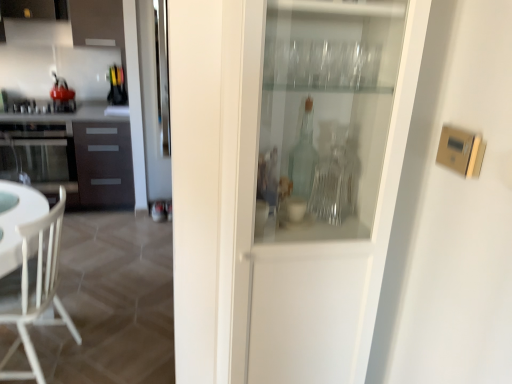
Question: Relative to dark brown wood cabinet at left, is transparent glass cabinet at center in front or behind?

Choices:
 (A) front
 (B) behind

Answer: (A)

Question: Looking at their shapes, would you say transparent glass cabinet at center is wider or thinner than dark brown wood cabinet at left?

Choices:
 (A) thin
 (B) wide

Answer: (A)

Question: Estimate the real-world distances between objects in this image. Which object is closer to the white wood chair at lower left?

Choices:
 (A) transparent glass cabinet at center
 (B) satin black oven at left
 (C) metallic silver stove at left, marked as the 2th appliance in a top-to-bottom arrangement
 (D) shiny red kettle at left, positioned as the 2th appliance in bottom-to-top order
 (E) dark brown wood cabinet at left

Answer: (A)

Question: Based on their relative distances, which object is farther from the transparent glass cabinet at center?

Choices:
 (A) shiny red kettle at left, positioned as the 2th appliance in bottom-to-top order
 (B) metallic silver stove at left, marked as the 2th appliance in a top-to-bottom arrangement
 (C) white wood chair at lower left
 (D) satin black oven at left
 (E) dark brown wood cabinet at left

Answer: (A)